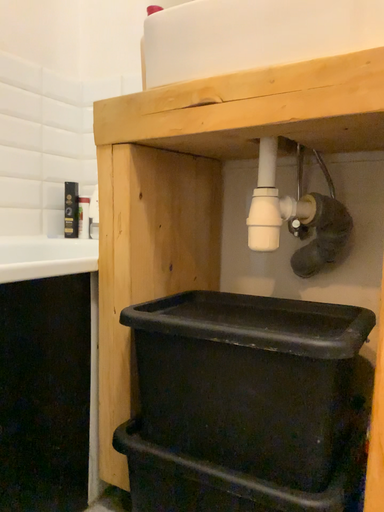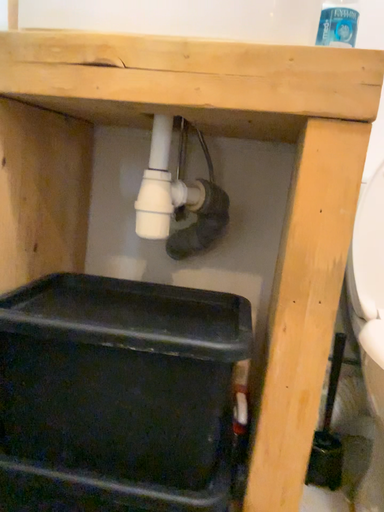
Question: Which way did the camera rotate in the video?

Choices:
 (A) rotated downward
 (B) rotated upward

Answer: (A)